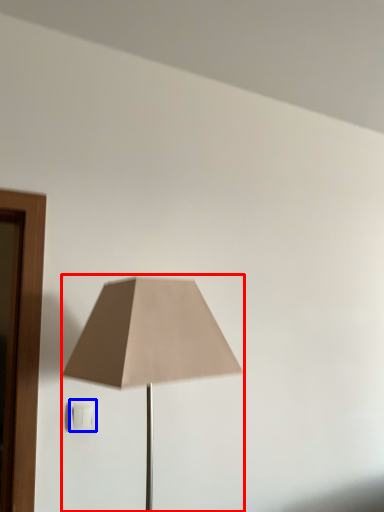
Question: Which object is further to the camera taking this photo, lamp (highlighted by a red box) or electric outlet (highlighted by a blue box)?

Choices:
 (A) lamp
 (B) electric outlet

Answer: (B)